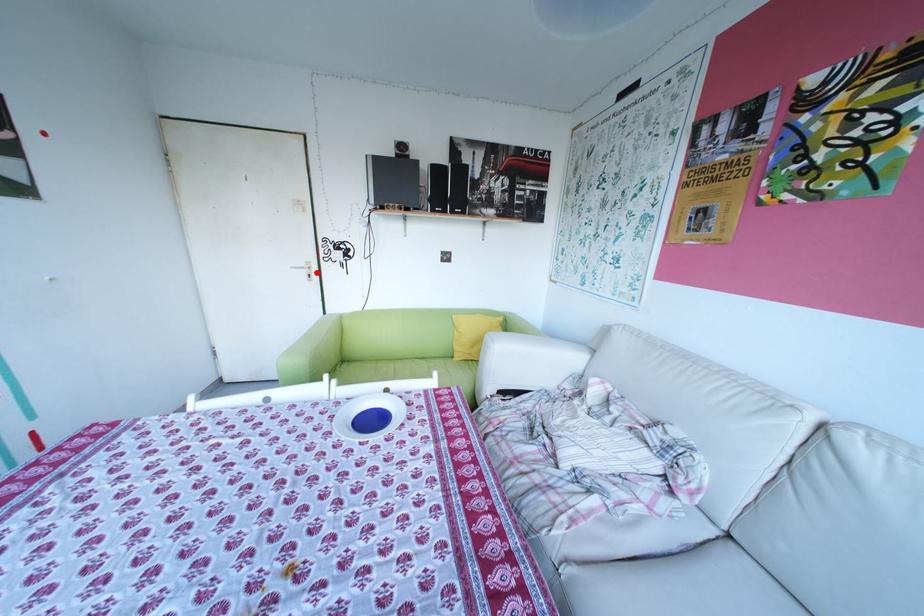
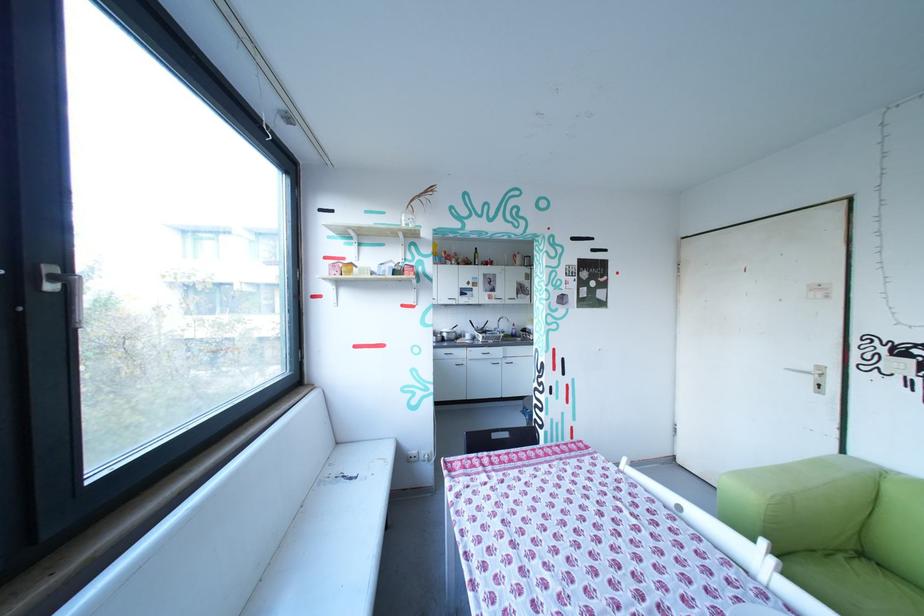
Question: I am providing you with two images of the same scene from different viewpoints. A red point is shown in image1. For the corresponding object point in image2, is it positioned nearer or farther from the camera?

Choices:
 (A) Nearer
 (B) Farther

Answer: (B)